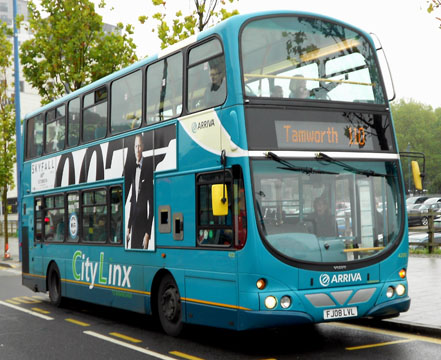
The height and width of the screenshot is (360, 441). In order to click on window in this screenshot , I will do `click(351, 237)`.